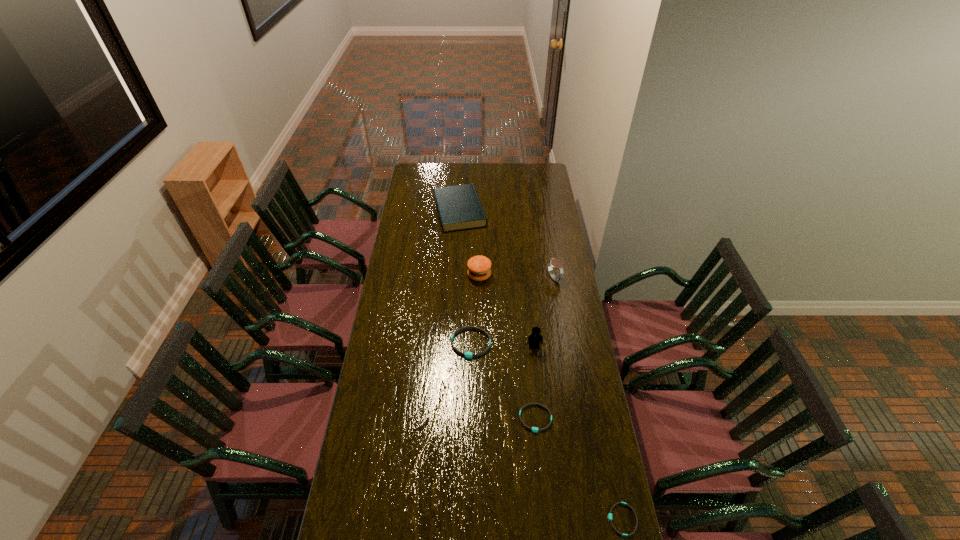
Find the location of a particular element. object located at the near edge is located at coordinates pos(610,514).

At what (x,y) coordinates should I click in order to perform the action: click on wristband that is at the right edge. Please return your answer as a coordinate pair (x, y). Looking at the image, I should click on (610, 514).

Locate an element on the screen. watch that is at the right edge is located at coordinates (553, 262).

Find the location of a particular element. object positioned at the near right corner is located at coordinates (610, 514).

The height and width of the screenshot is (540, 960). In the image, there is a desktop. What are the coordinates of `free space at the left edge` in the screenshot? It's located at (380, 397).

In the image, there is a desktop. Identify the location of vacant region at the right edge. This screenshot has width=960, height=540. (537, 251).

Image resolution: width=960 pixels, height=540 pixels. In the image, there is a desktop. What are the coordinates of `free space at the far right corner` in the screenshot? It's located at (550, 173).

The image size is (960, 540). Find the location of `blank region between the Lego and the farthest object`. blank region between the Lego and the farthest object is located at coordinates (497, 279).

In order to click on vacant space that's between the nearest object and the Lego in this screenshot , I will do `click(578, 433)`.

Where is `free point between the farthest object and the patty`? free point between the farthest object and the patty is located at coordinates (469, 243).